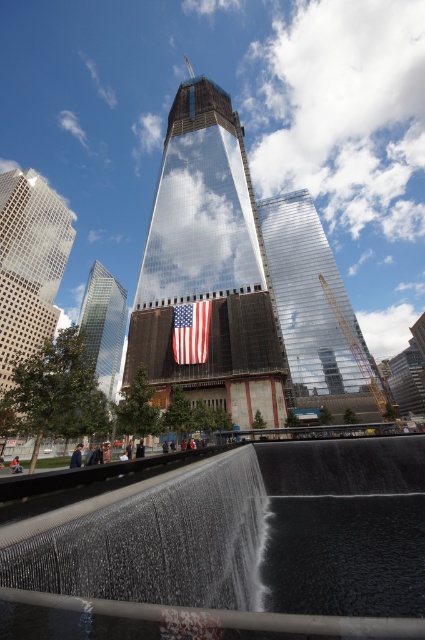
Question: Among these points, which one is farthest from the camera?

Choices:
 (A) (183, 356)
 (B) (104, 536)

Answer: (A)

Question: Is reflective glass skyscraper at center to the left of clear glass skyscraper at left from the viewer's perspective?

Choices:
 (A) yes
 (B) no

Answer: (B)

Question: Is black smooth water at lower center above clear glass skyscraper at left?

Choices:
 (A) no
 (B) yes

Answer: (B)

Question: Is reflective glass skyscraper at center to the right of clear glass skyscraper at left from the viewer's perspective?

Choices:
 (A) no
 (B) yes

Answer: (B)

Question: Which point is farther from the camera taking this photo?

Choices:
 (A) (198, 116)
 (B) (198, 305)

Answer: (A)

Question: Based on their relative distances, which object is farther from the shiny glass skyscraper at center?

Choices:
 (A) black smooth water at lower center
 (B) american flag at center

Answer: (A)